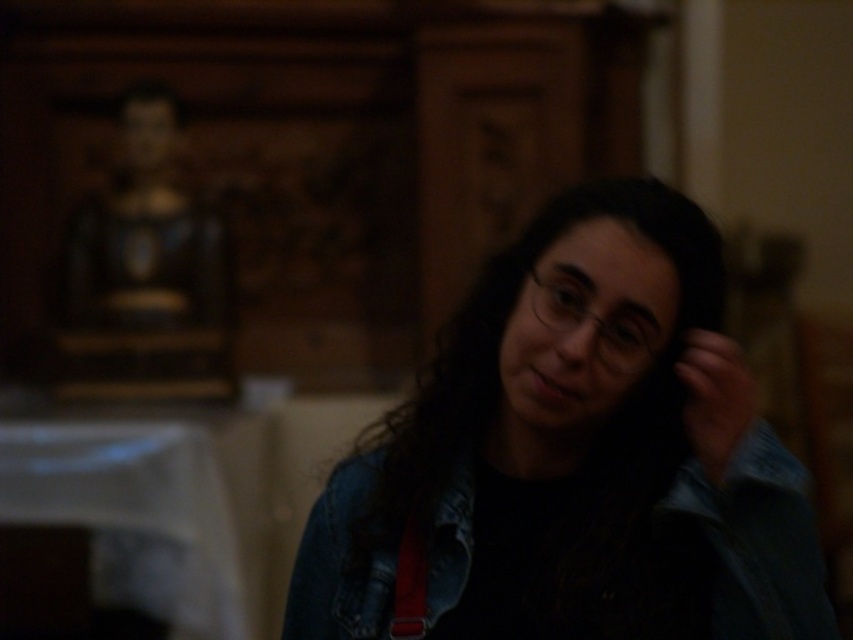
Question: Among these points, which one is nearest to the camera?

Choices:
 (A) (813, 582)
 (B) (799, 561)

Answer: (B)

Question: Can you confirm if denim jacket at center is positioned to the right of matte black hand at right?

Choices:
 (A) no
 (B) yes

Answer: (A)

Question: Does denim jacket at center appear on the right side of denim jacket at lower right?

Choices:
 (A) yes
 (B) no

Answer: (B)

Question: Which object is positioned closest to the matte black hand at right?

Choices:
 (A) denim jacket at lower right
 (B) denim jacket at center

Answer: (A)

Question: Estimate the real-world distances between objects in this image. Which object is closer to the denim jacket at center?

Choices:
 (A) denim jacket at lower right
 (B) matte black hand at right

Answer: (A)

Question: Is wooden statue at upper left to the right of matte black hand at right from the viewer's perspective?

Choices:
 (A) no
 (B) yes

Answer: (A)